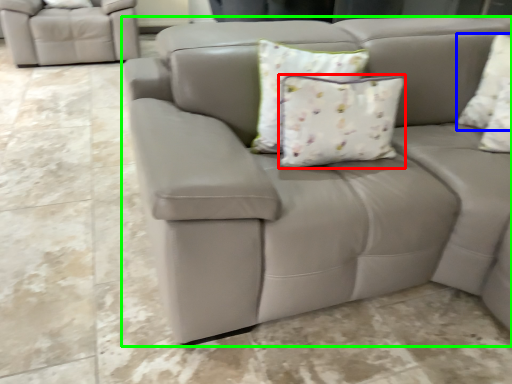
Question: Which object is the farthest from pillow (highlighted by a red box)? Choose among these: pillow (highlighted by a blue box) or studio couch (highlighted by a green box).

Choices:
 (A) pillow
 (B) studio couch

Answer: (A)